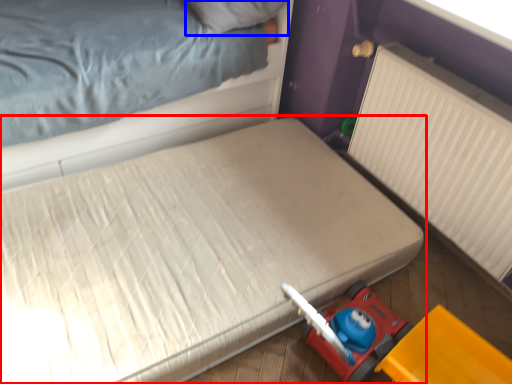
Question: Among these objects, which one is nearest to the camera, bed (highlighted by a red box) or pillow (highlighted by a blue box)?

Choices:
 (A) bed
 (B) pillow

Answer: (A)